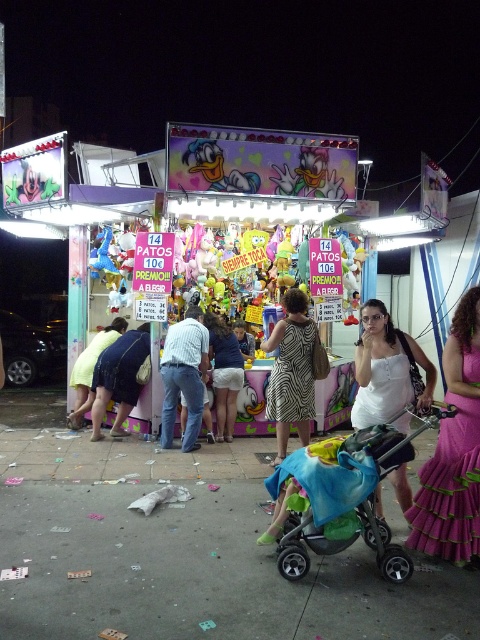
Question: Does zebra print dress at center appear under striped fabric shirt at center?

Choices:
 (A) yes
 (B) no

Answer: (B)

Question: Which is farther from the striped fabric shirt at center?

Choices:
 (A) white satin dress at center
 (B) black plastic baby carriage at lower right
 (C) pink satin dress at lower right
 (D) white lace skirt at center

Answer: (C)

Question: Which of these objects is positioned farthest from the pink satin dress at lower right?

Choices:
 (A) white satin dress at center
 (B) black plastic baby carriage at lower right
 (C) striped fabric shirt at center
 (D) white lace skirt at center

Answer: (D)

Question: Is the position of black plastic baby carriage at lower right less distant than that of white lace skirt at center?

Choices:
 (A) no
 (B) yes

Answer: (B)

Question: Is black plastic baby carriage at lower right thinner than pink satin dress at lower right?

Choices:
 (A) no
 (B) yes

Answer: (A)

Question: Which point appears closest to the camera in this image?

Choices:
 (A) (303, 364)
 (B) (301, 392)
 (C) (229, 396)
 (D) (392, 368)

Answer: (D)